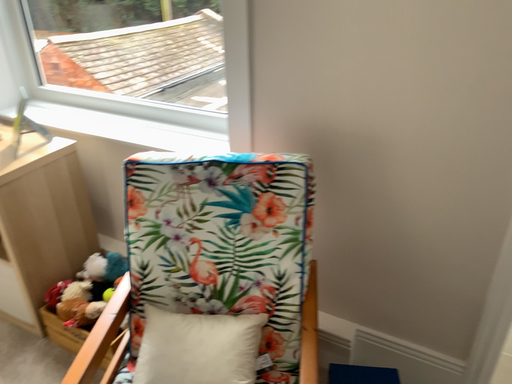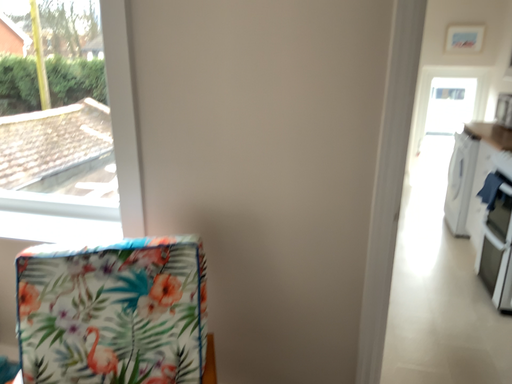
Question: How did the camera likely rotate when shooting the video?

Choices:
 (A) rotated left
 (B) rotated right

Answer: (B)